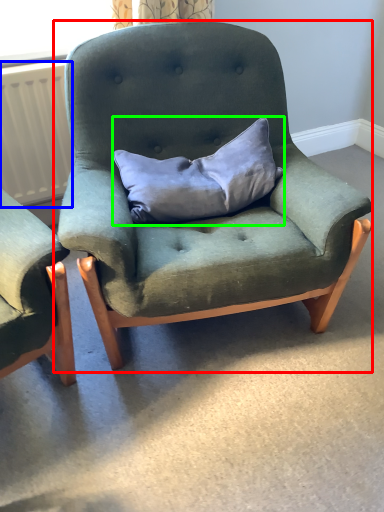
Question: Based on their relative distances, which object is nearer to chair (highlighted by a red box)? Choose from radiator (highlighted by a blue box) and pillow (highlighted by a green box).

Choices:
 (A) radiator
 (B) pillow

Answer: (B)